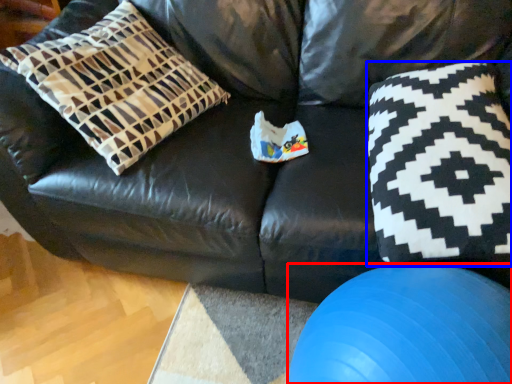
Question: Which point is further to the camera, ball (highlighted by a red box) or throw pillow (highlighted by a blue box)?

Choices:
 (A) ball
 (B) throw pillow

Answer: (B)